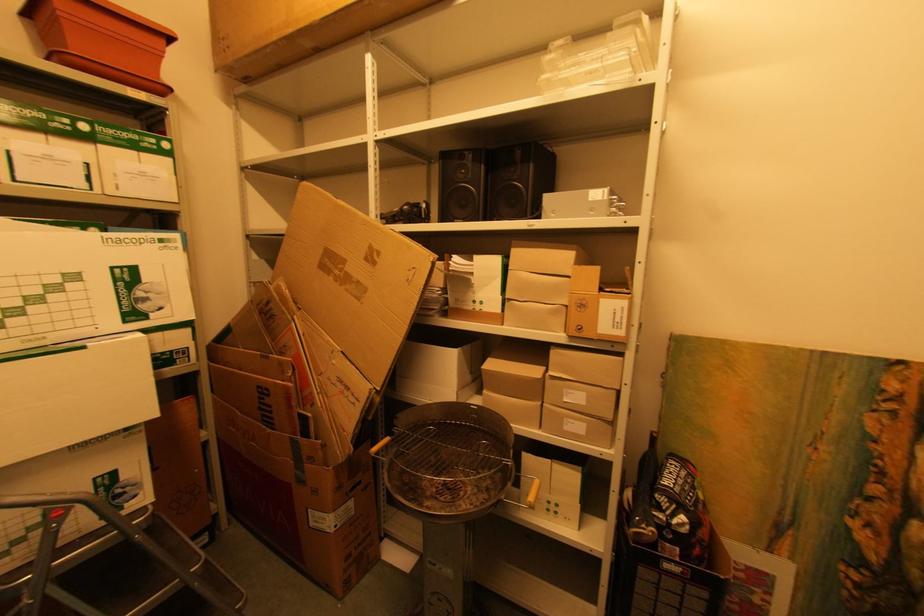
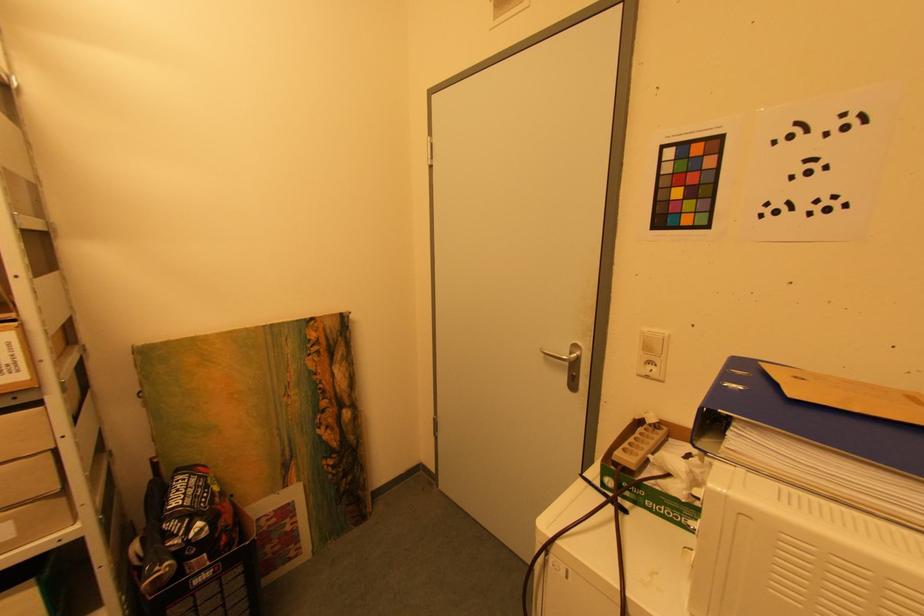
Question: The camera is either moving clockwise (left) or counter-clockwise (right) around the object. The first image is from the beginning of the video and the second image is from the end. Is the camera moving left or right when shooting the video?

Choices:
 (A) Left
 (B) Right

Answer: (A)